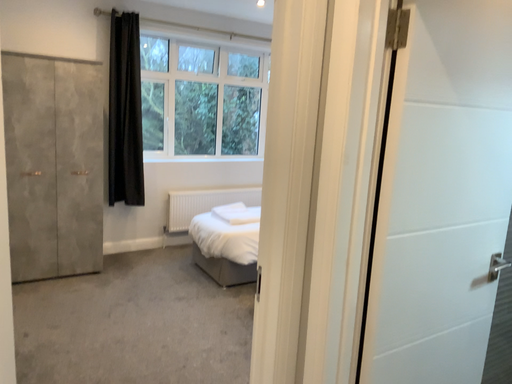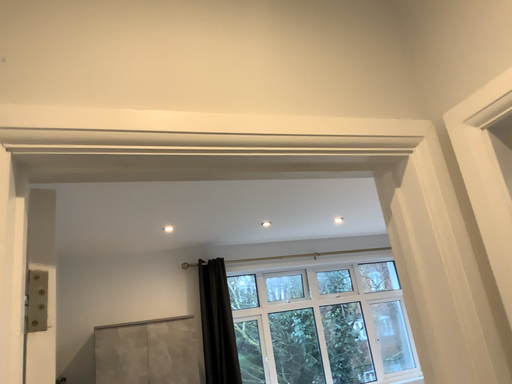
Question: Which way did the camera rotate in the video?

Choices:
 (A) rotated downward
 (B) rotated upward

Answer: (B)